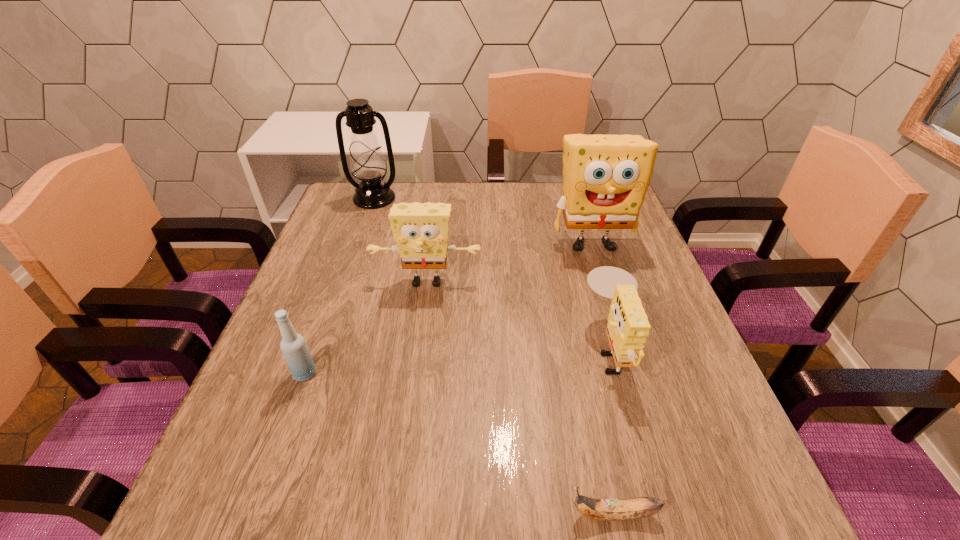
Locate an element on the screen. This screenshot has height=540, width=960. oil lamp is located at coordinates (367, 163).

The height and width of the screenshot is (540, 960). I want to click on the farthest sponge, so click(605, 177).

This screenshot has width=960, height=540. In order to click on the second farthest object in this screenshot , I will do `click(605, 177)`.

The height and width of the screenshot is (540, 960). I want to click on the fourth shortest object, so click(x=421, y=230).

The height and width of the screenshot is (540, 960). In order to click on the third farthest object in this screenshot , I will do `click(421, 230)`.

Where is `bottle`? bottle is located at coordinates (293, 345).

You are a GUI agent. You are given a task and a screenshot of the screen. Output one action in this format:
    pyautogui.click(x=<x>, y=<y>)
    Task: Click on the nearest sponge
    
    Given the screenshot: What is the action you would take?
    pyautogui.click(x=628, y=327)

The image size is (960, 540). What are the coordinates of `the shortest object` in the screenshot? It's located at (598, 509).

This screenshot has width=960, height=540. I want to click on banana, so click(598, 509).

Locate an element on the screen. The width and height of the screenshot is (960, 540). vacant area located on the right of the farthest object is located at coordinates (516, 198).